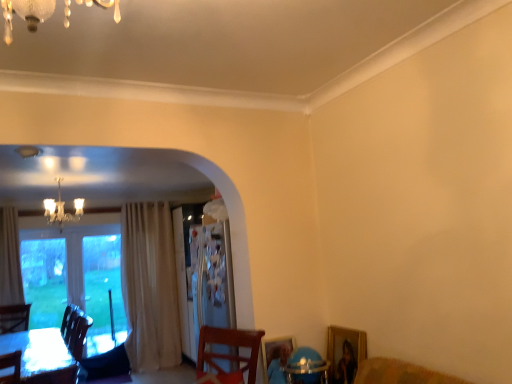
Question: Is crystal chandelier at upper left in front of or behind gold-framed picture at lower right in the image?

Choices:
 (A) front
 (B) behind

Answer: (B)

Question: Considering the positions of crystal chandelier at upper left and gold-framed picture at lower right in the image, is crystal chandelier at upper left bigger or smaller than gold-framed picture at lower right?

Choices:
 (A) small
 (B) big

Answer: (B)

Question: Considering the real-world distances, which object is closest to the gold-framed picture at lower right?

Choices:
 (A) crystal chandelier at upper left
 (B) transparent glass window at left
 (C) white glossy table at lower left
 (D) blue plastic round table at lower right

Answer: (D)

Question: Which object is the farthest from the transparent glass window at left?

Choices:
 (A) crystal chandelier at upper left
 (B) blue plastic round table at lower right
 (C) white glossy table at lower left
 (D) gold-framed picture at lower right

Answer: (D)